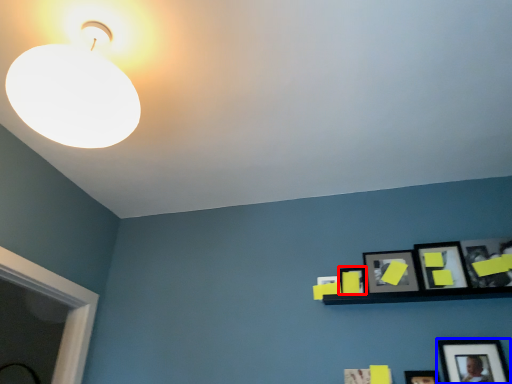
Question: Among these objects, which one is nearest to the camera, picture frame (highlighted by a red box) or picture frame (highlighted by a blue box)?

Choices:
 (A) picture frame
 (B) picture frame

Answer: (B)